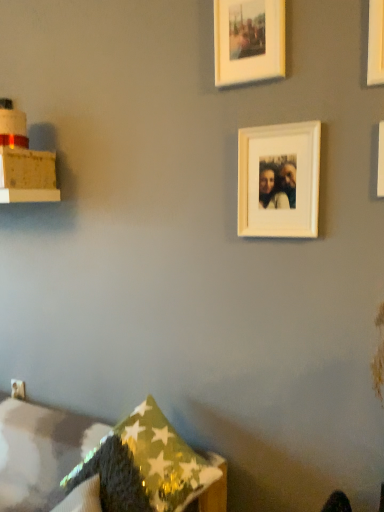
Question: In which direction should I rotate to look at white matte picture frame at upper center, the 1th picture frame when ordered from bottom to top?

Choices:
 (A) right
 (B) left

Answer: (A)

Question: Is shiny metallic pillow at lower center, the first pillow when ordered from back to front, located outside white matte picture frame at upper right, positioned as the second picture frame in bottom-to-top order?

Choices:
 (A) yes
 (B) no

Answer: (A)

Question: Is shiny metallic pillow at lower center, the first pillow when ordered from back to front, bigger than white matte picture frame at upper right, the first picture frame from the right?

Choices:
 (A) no
 (B) yes

Answer: (B)

Question: Is shiny metallic pillow at lower center, the first pillow when ordered from back to front, thinner than white matte picture frame at upper right, which appears as the 2th picture frame when viewed from the top?

Choices:
 (A) no
 (B) yes

Answer: (A)

Question: From a real-world perspective, is shiny metallic pillow at lower center, the first pillow when ordered from back to front, located beneath white matte picture frame at upper right, the first picture frame from the right?

Choices:
 (A) yes
 (B) no

Answer: (A)

Question: From a real-world perspective, is shiny metallic pillow at lower center, marked as the 2th pillow in a front-to-back arrangement, over white matte picture frame at upper right, the 3th picture frame positioned from the left?

Choices:
 (A) yes
 (B) no

Answer: (B)

Question: From the image's perspective, is shiny metallic pillow at lower center, the first pillow when ordered from back to front, on white matte picture frame at upper right, which appears as the 2th picture frame when viewed from the top?

Choices:
 (A) no
 (B) yes

Answer: (A)

Question: Is white matte picture frame at upper center, the third picture frame from the top, next to white matte picture frame at upper right, which appears as the 2th picture frame when viewed from the top?

Choices:
 (A) no
 (B) yes

Answer: (A)

Question: Is white matte picture frame at upper center, arranged as the second picture frame when viewed from the right, to the left of white matte picture frame at upper right, the 3th picture frame positioned from the left, from the viewer's perspective?

Choices:
 (A) no
 (B) yes

Answer: (B)

Question: From the image's perspective, is white matte picture frame at upper center, arranged as the second picture frame when viewed from the right, located above white matte picture frame at upper right, which appears as the 2th picture frame when viewed from the top?

Choices:
 (A) no
 (B) yes

Answer: (A)

Question: Considering the relative sizes of white matte picture frame at upper center, which ranks as the 2th picture frame in left-to-right order, and white matte picture frame at upper right, the 3th picture frame positioned from the left, in the image provided, is white matte picture frame at upper center, which ranks as the 2th picture frame in left-to-right order, bigger than white matte picture frame at upper right, the 3th picture frame positioned from the left,?

Choices:
 (A) no
 (B) yes

Answer: (B)

Question: Is white matte picture frame at upper center, which ranks as the 2th picture frame in left-to-right order, positioned beyond the bounds of white matte picture frame at upper right, the 3th picture frame positioned from the left?

Choices:
 (A) no
 (B) yes

Answer: (B)

Question: Could white matte picture frame at upper right, positioned as the second picture frame in bottom-to-top order, be considered to be inside white matte picture frame at upper center, the 1th picture frame when ordered from bottom to top?

Choices:
 (A) no
 (B) yes

Answer: (A)

Question: Can you confirm if shiny metallic pillow at lower center, the first pillow when ordered from back to front, is shorter than white matte picture frame at upper center, which is the first picture frame in left-to-right order?

Choices:
 (A) yes
 (B) no

Answer: (B)